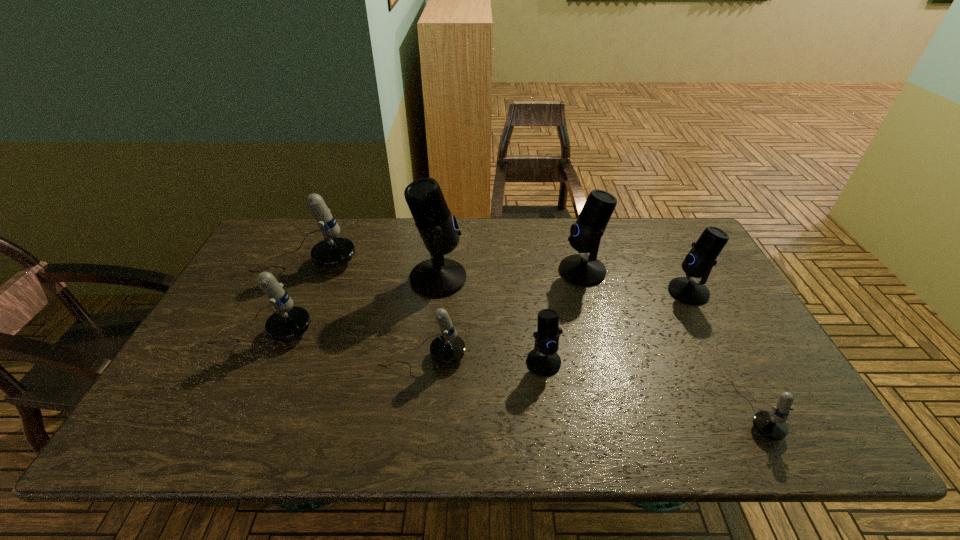
Find the location of `free space in the image that satisfies the following two spatial constraints: 1. on the stand of the nearest white microphone; 2. on the left side of the sixth microphone from left to right`. free space in the image that satisfies the following two spatial constraints: 1. on the stand of the nearest white microphone; 2. on the left side of the sixth microphone from left to right is located at coordinates (620, 411).